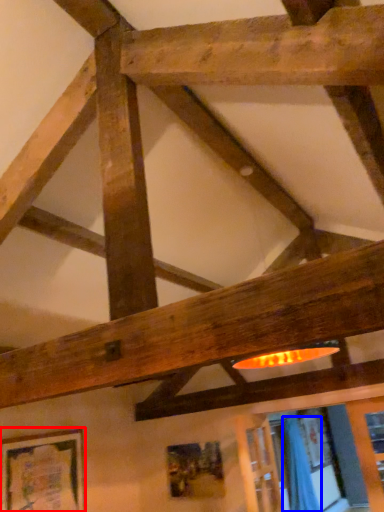
Question: Which object is further to the camera taking this photo, picture frame (highlighted by a red box) or curtain (highlighted by a blue box)?

Choices:
 (A) picture frame
 (B) curtain

Answer: (B)